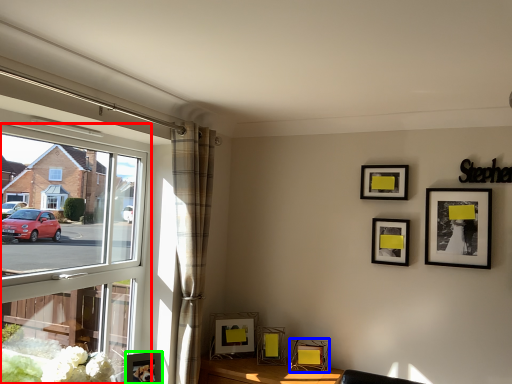
Question: Which is farther away from window (highlighted by a red box)? picture frame (highlighted by a blue box) or picture frame (highlighted by a green box)?

Choices:
 (A) picture frame
 (B) picture frame

Answer: (A)